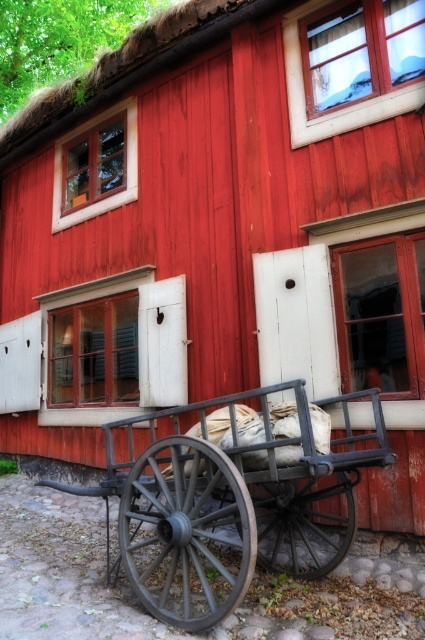
You are a delivery person trying to fit the rustic wood wagon at lower center and the dark gray wooden wagon wheel at lower center into a storage area. The storage area has a width limit of 1.2 meters. Which object might not fit if placed individually?

The rustic wood wagon at lower center has a greater width than the dark gray wooden wagon wheel at lower center. Since the storage area has a width limit of 1.2 meters, the rustic wood wagon at lower center might not fit if placed individually, depending on its exact dimensions.

You are standing in front of the building and notice two dark gray wagon wheels. The first is the dark gray wooden wagon wheel at lower center, and the second is the dark gray wood wagon wheel at center. Which of these two wheels is located higher up from the ground?

The dark gray wood wagon wheel at center is located higher up from the ground because it is positioned above the dark gray wooden wagon wheel at lower center.

You are standing in front of the red wooden building and see the rustic wood wagon at lower center and the dark gray wooden wagon wheel at lower center. Which object is closer to you?

The rustic wood wagon at lower center is above the dark gray wooden wagon wheel at lower center, so the dark gray wooden wagon wheel at lower center is closer to you.